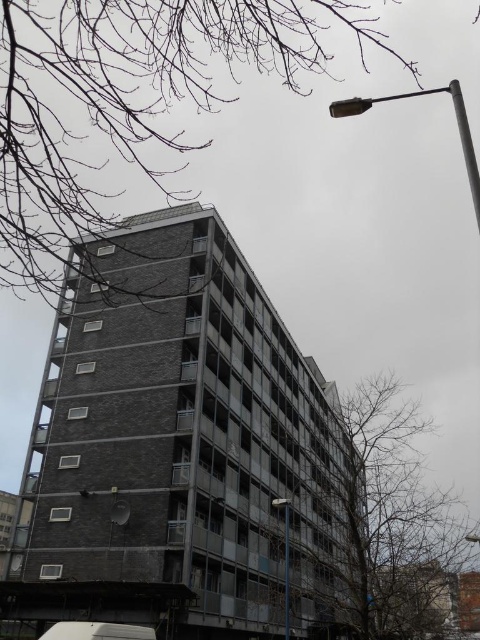
Image resolution: width=480 pixels, height=640 pixels. Describe the element at coordinates (456, 118) in the screenshot. I see `metallic pole at upper right` at that location.

The height and width of the screenshot is (640, 480). I want to click on metallic pole at upper right, so click(x=456, y=118).